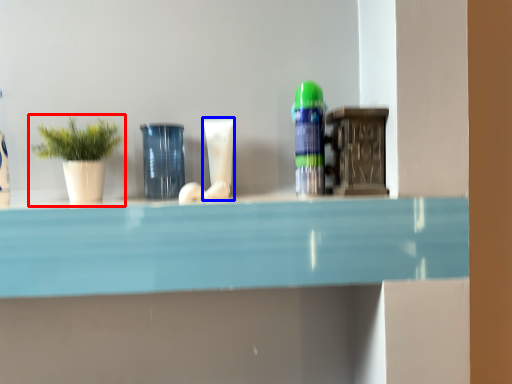
Question: Which of the following is the farthest to the observer, houseplant (highlighted by a red box) or toiletry (highlighted by a blue box)?

Choices:
 (A) houseplant
 (B) toiletry

Answer: (B)